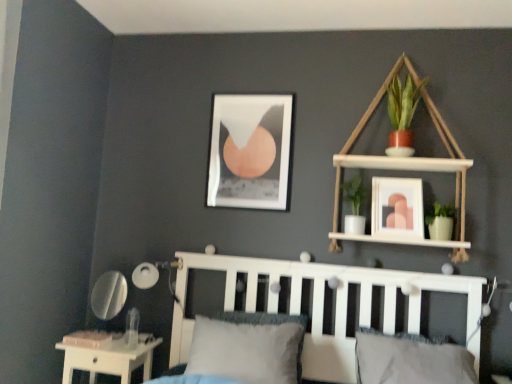
Question: From their relative heights in the image, would you say gray fabric pillow at lower center, which ranks as the 2th pillow in left-to-right order, is taller or shorter than white matte lamp at lower left?

Choices:
 (A) short
 (B) tall

Answer: (B)

Question: Based on their positions, is gray fabric pillow at lower center, which ranks as the 2th pillow in left-to-right order, located to the left or right of white matte lamp at lower left?

Choices:
 (A) left
 (B) right

Answer: (B)

Question: Which object is the closest to the gray fabric pillow at lower center, marked as the 1th pillow in a right-to-left arrangement?

Choices:
 (A) matte pink picture frame at upper center, which is counted as the 2th picture frame, starting from the left
 (B) white wood bookshelf at upper right
 (C) gray textured pillow at center, the 2th pillow from the right
 (D) white matte lamp at lower left
 (E) white glossy table at lower left

Answer: (C)

Question: Estimate the real-world distances between objects in this image. Which object is farther from the white wood bookshelf at upper right?

Choices:
 (A) white wooden bed frame at center
 (B) gray textured pillow at center, which appears as the first pillow when viewed from the left
 (C) white matte lamp at lower left
 (D) matte pink picture frame at upper center, positioned as the 1th picture frame in right-to-left order
 (E) white glossy table at lower left

Answer: (E)